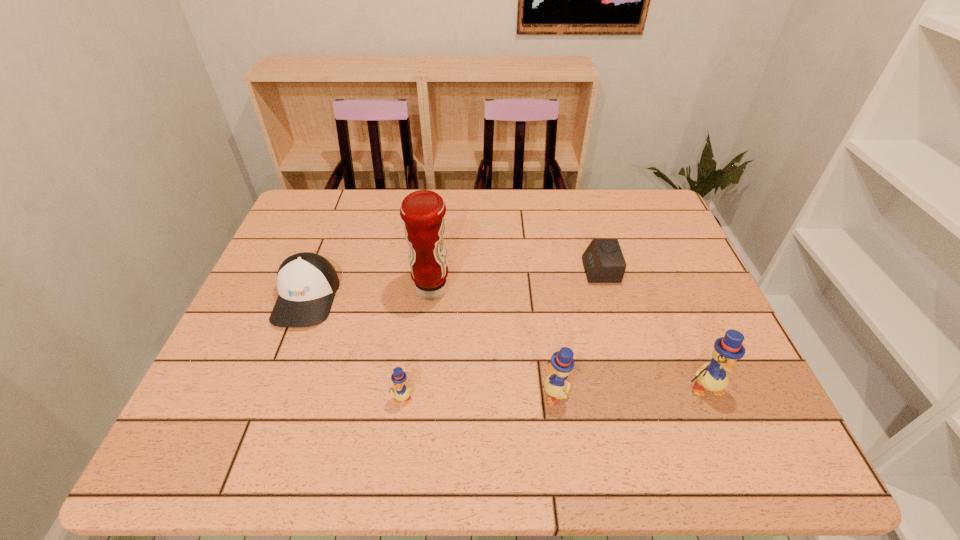
Please point a spot on the left to add another duckling. Please provide its 2D coordinates. Your answer should be formatted as a tuple, i.e. [(x, y)], where the tuple contains the x and y coordinates of a point satisfying the conditions above.

[(247, 404)]